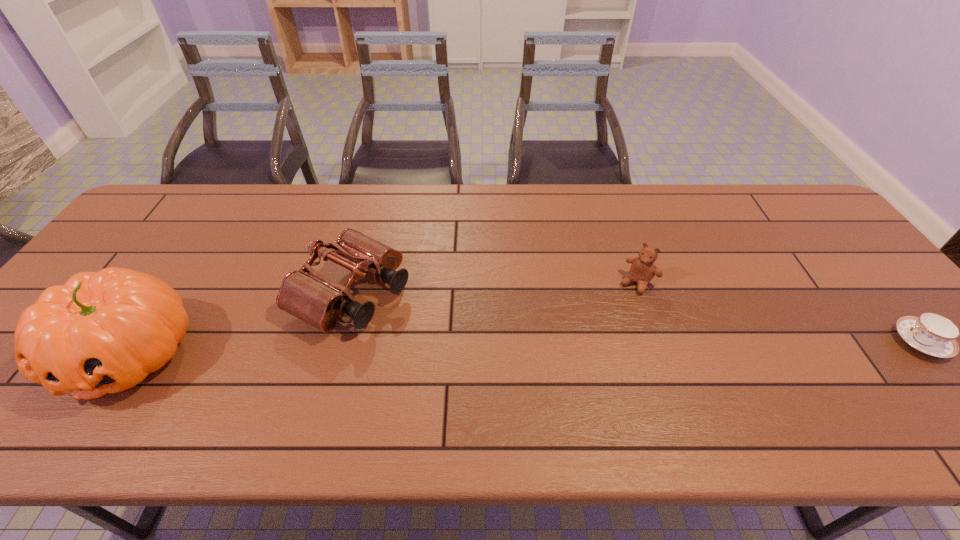
At what (x,y) coordinates should I click in order to perform the action: click on free space between the third object from left to right and the tallest object. Please return your answer as a coordinate pair (x, y). This screenshot has height=540, width=960. Looking at the image, I should click on [x=383, y=318].

The height and width of the screenshot is (540, 960). In order to click on empty space between the binoculars and the third tallest object in this screenshot , I will do `click(494, 288)`.

You are a GUI agent. You are given a task and a screenshot of the screen. Output one action in this format:
    pyautogui.click(x=<x>, y=<y>)
    Task: Click on the vacant space that is in between the third tallest object and the third shortest object
    
    Given the screenshot: What is the action you would take?
    pyautogui.click(x=494, y=288)

The width and height of the screenshot is (960, 540). Find the location of `vacant space that's between the second shortest object and the second object from left to right`. vacant space that's between the second shortest object and the second object from left to right is located at coordinates (494, 288).

Where is `object that is the second closest one to the leftmost object`? This screenshot has height=540, width=960. object that is the second closest one to the leftmost object is located at coordinates click(x=643, y=269).

Locate which object is the closest to the tallest object. Please provide its 2D coordinates. Your answer should be formatted as a tuple, i.e. [(x, y)], where the tuple contains the x and y coordinates of a point satisfying the conditions above.

[(305, 294)]